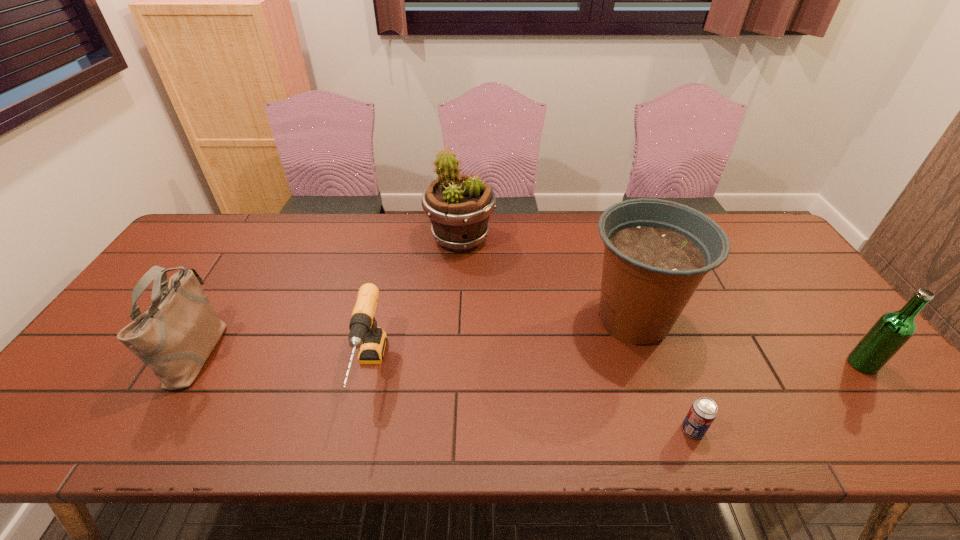
Identify the location of the left flowerpot. This screenshot has width=960, height=540. (459, 207).

At what (x,y) coordinates should I click in order to perform the action: click on the fourth object from right to left. Please return your answer as a coordinate pair (x, y). The image size is (960, 540). Looking at the image, I should click on (459, 207).

You are a GUI agent. You are given a task and a screenshot of the screen. Output one action in this format:
    pyautogui.click(x=<x>, y=<y>)
    Task: Click on the nearer flowerpot
    Image resolution: width=960 pixels, height=540 pixels.
    Given the screenshot: What is the action you would take?
    pyautogui.click(x=657, y=252)

Locate an element on the screen. shoulder bag is located at coordinates (175, 336).

At what (x,y) coordinates should I click in order to perform the action: click on beer bottle. Please return your answer as a coordinate pair (x, y). The height and width of the screenshot is (540, 960). Looking at the image, I should click on (892, 330).

Where is `the second object from left to right`? the second object from left to right is located at coordinates (364, 334).

Locate an element on the screen. drill is located at coordinates (364, 334).

The height and width of the screenshot is (540, 960). I want to click on beer can, so click(703, 411).

Find the location of `free space located 0.320m on the left of the farther flowerpot`. free space located 0.320m on the left of the farther flowerpot is located at coordinates (329, 238).

The width and height of the screenshot is (960, 540). Find the location of `free region located 0.190m on the front of the nearer flowerpot`. free region located 0.190m on the front of the nearer flowerpot is located at coordinates [x=674, y=435].